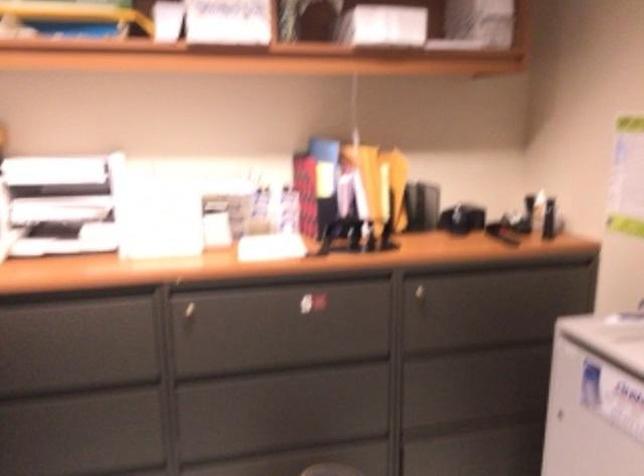
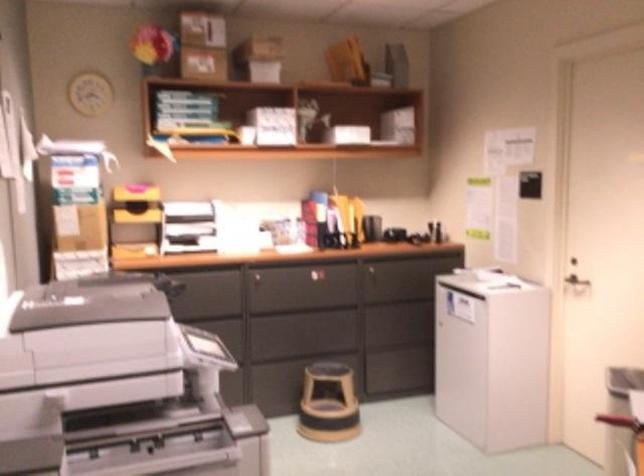
Find the pixel in the second image that matches point 375,182 in the first image.

(348, 214)